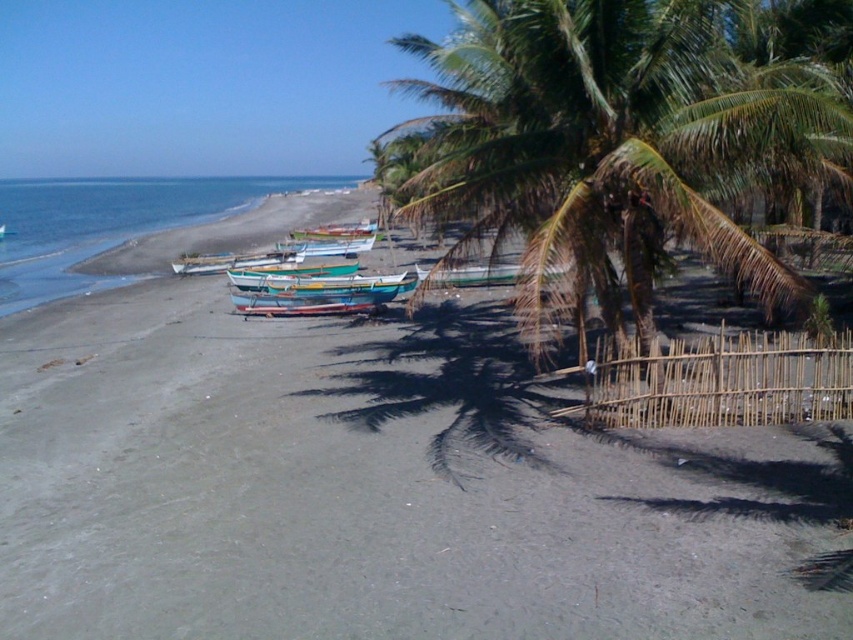
You are standing on the beach and want to take a photo of the gray sand at center and the green leafy coconut tree at center. Which object will appear closer to the bottom of your photo?

The gray sand at center will appear closer to the bottom of the photo because it is shorter than the green leafy coconut tree at center.

You are a lifeguard standing on the beach and need to reach both the wooden painted boat at center and the green painted wooden boat at center quickly. Which boat is closer to you?

Both the wooden painted boat at center and the green painted wooden boat at center are 9.86 meters apart from each other, so their distance from you depends on your current position. Without knowing where you are standing, it is impossible to determine which one is closer.